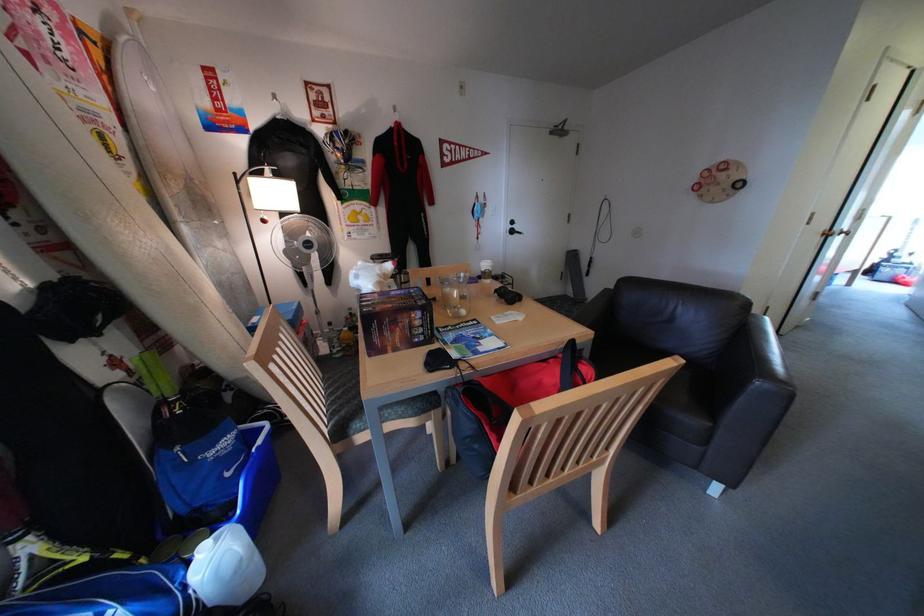
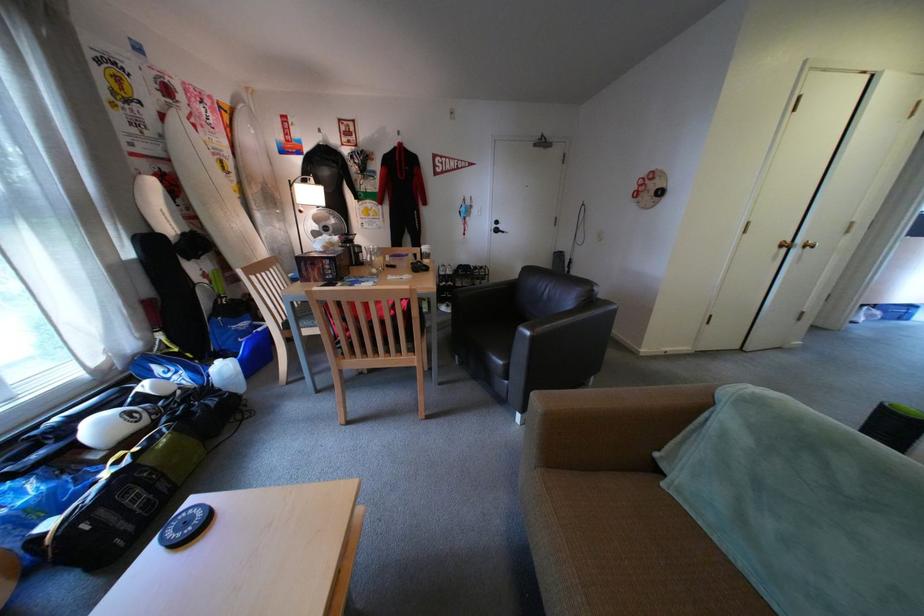
Locate, in the second image, the point that corresponds to pixel 843 230 in the first image.

(804, 241)